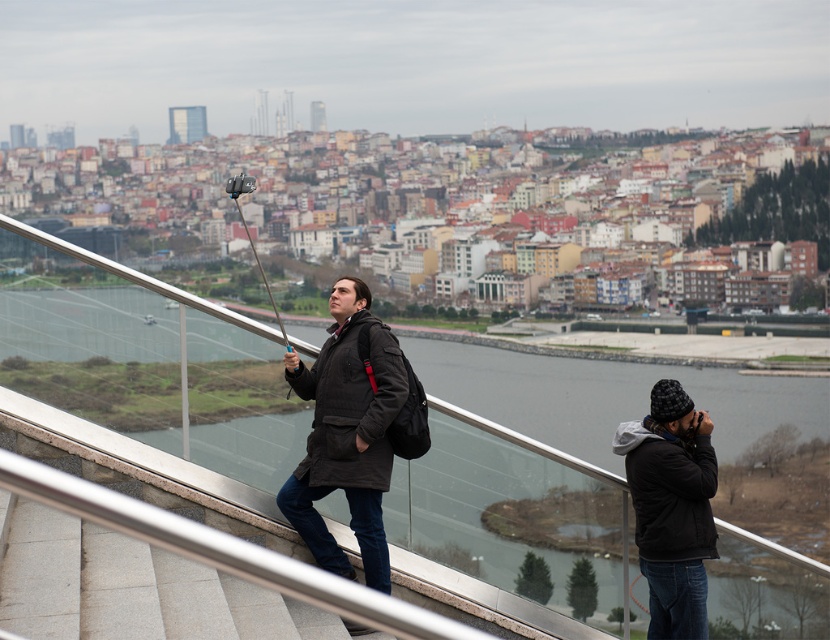
You are a city planner assessing safety in this urban area. The two people are standing on a metal railing overlooking the city. The transparent glass water at center is between them. Given that the distance between them is 59.24 meters, is this distance safe for maintaining social distancing guidelines of 2 meters apart?

The two people are 59.24 meters apart, which is significantly more than the required 2 meters for social distancing. Therefore, the distance between them is safe.

From the picture: You are a photographer standing in the urban area shown. You notice the transparent glass water at center and the dark brown leather jacket at center. Which object is positioned lower in the scene?

The transparent glass water at center is located below dark brown leather jacket at center, so it is positioned lower in the scene.

You are a tour guide explaining the city layout to tourists. You point out the transparent glass water at center and the black quilted jacket at lower right. Which object is positioned higher in the image?

The black quilted jacket at lower right is positioned higher than the transparent glass water at center, as the water is located below it.